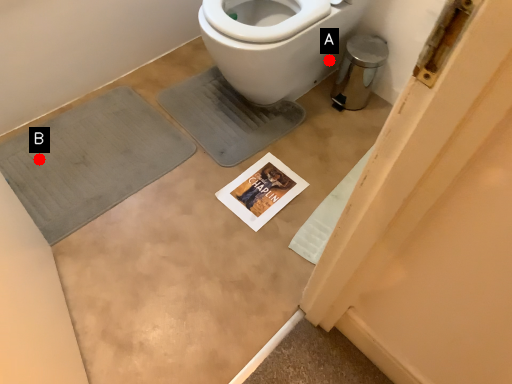
Question: Two points are circled on the image, labeled by A and B beside each circle. Among these points, which one is farthest from the camera?

Choices:
 (A) A is further
 (B) B is further

Answer: (A)